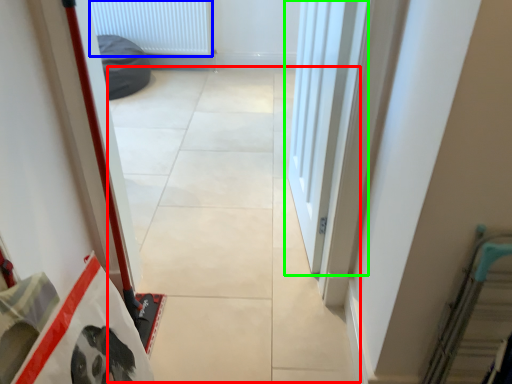
Question: Which object is the closest to the concrete (highlighted by a red box)? Choose among these: radiator (highlighted by a blue box) or door (highlighted by a green box).

Choices:
 (A) radiator
 (B) door

Answer: (B)